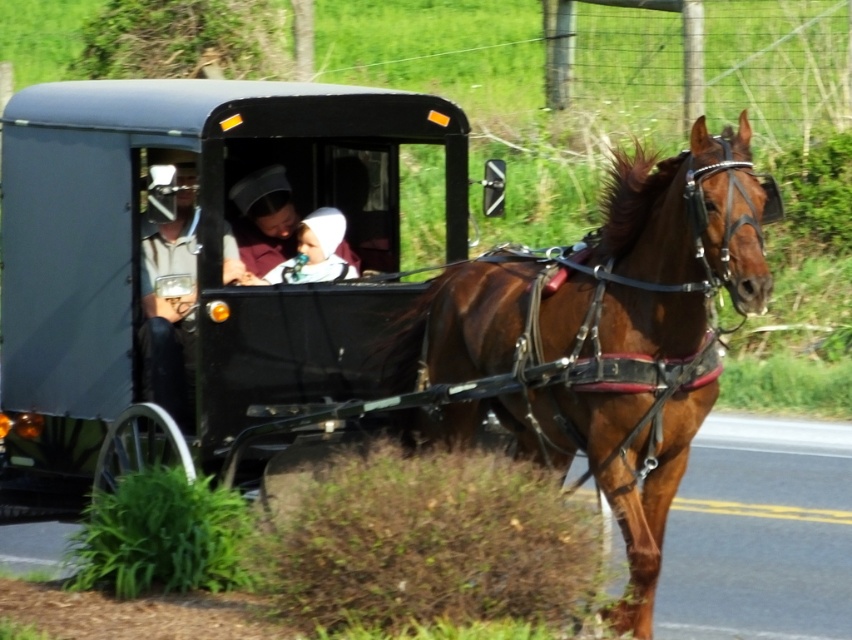
You are a passenger in the buggy and want to place your light brown leather jacket at center on the brown glossy harness at center. Can the jacket fit on the harness?

The brown glossy harness at center is wider than the light brown leather jacket at center, so the jacket can fit on the harness.

You are standing on the side of the road and see the horse and buggy. There is a point marked at coordinates [603,339]. What object is located at this point?

The point at coordinates [603,339] indicates the brown glossy harness at center.